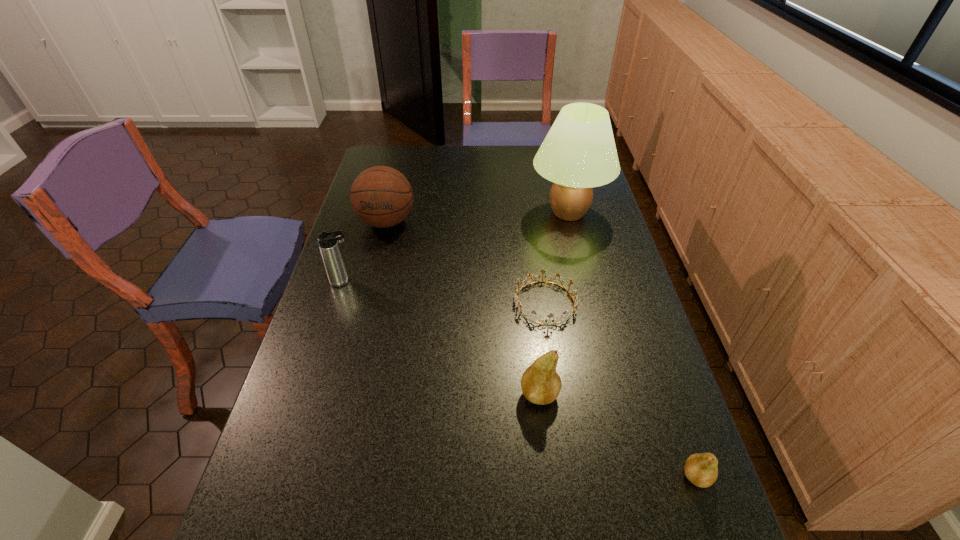
Where is `free location that satisfies the following two spatial constraints: 1. on the handle side of the thermos bottle; 2. on the back side of the shorter pear`? Image resolution: width=960 pixels, height=540 pixels. free location that satisfies the following two spatial constraints: 1. on the handle side of the thermos bottle; 2. on the back side of the shorter pear is located at coordinates (282, 476).

Find the location of a particular element. free region that satisfies the following two spatial constraints: 1. on the side with brand label of the farther pear; 2. on the right side of the basketball is located at coordinates (343, 394).